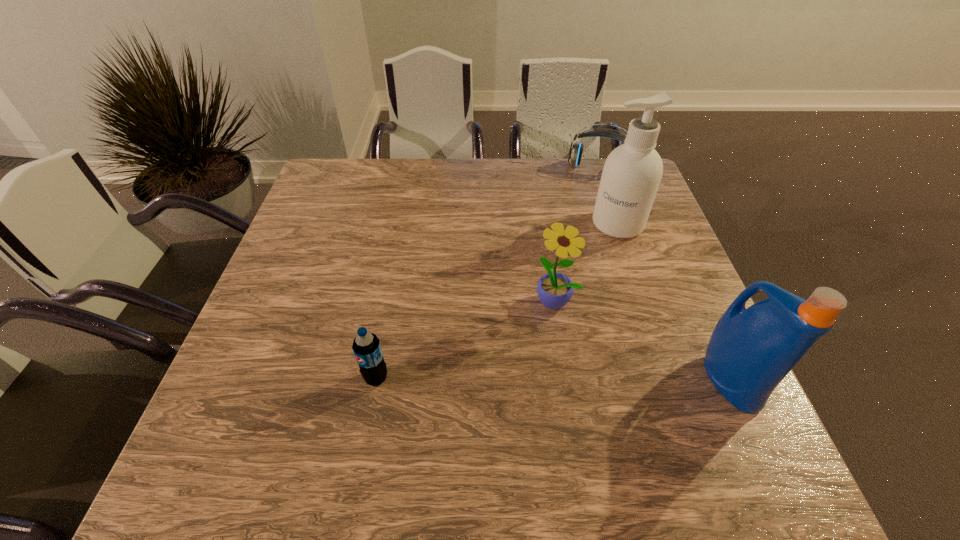
In order to click on the leftmost object in this screenshot , I will do `click(366, 346)`.

The height and width of the screenshot is (540, 960). What are the coordinates of `the second tallest object` in the screenshot? It's located at tap(750, 352).

The width and height of the screenshot is (960, 540). In order to click on the tallest object in this screenshot , I will do `click(632, 172)`.

At what (x,y) coordinates should I click in order to perform the action: click on the second farthest object. Please return your answer as a coordinate pair (x, y). The image size is (960, 540). Looking at the image, I should click on (632, 172).

What are the coordinates of `the farthest object` in the screenshot? It's located at (575, 152).

Find the location of a particular element. the second object from left to right is located at coordinates (554, 290).

Identify the location of the third nearest object. This screenshot has height=540, width=960. (554, 290).

At what (x,y) coordinates should I click in order to perform the action: click on free spot located 0.200m on the back of the soda bottle. Please return your answer as a coordinate pair (x, y). The image size is (960, 540). Looking at the image, I should click on (392, 294).

Locate an element on the screen. free space located 0.130m on the front label of the fourth nearest object is located at coordinates (591, 268).

Where is `vacant area located 0.100m on the front label of the fourth nearest object`? vacant area located 0.100m on the front label of the fourth nearest object is located at coordinates (596, 261).